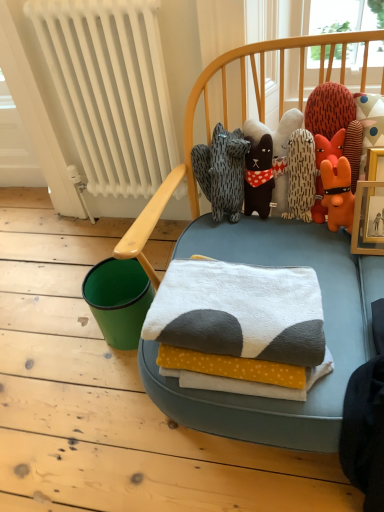
Question: Is soft plush toys at center, the 2th toy when ordered from right to left, in front of or behind white soft towel at center in the image?

Choices:
 (A) front
 (B) behind

Answer: (B)

Question: Is point (249, 119) closer or farther from the camera than point (172, 295)?

Choices:
 (A) farther
 (B) closer

Answer: (A)

Question: Estimate the real-world distances between objects in this image. Which object is farther from the white soft towel at center?

Choices:
 (A) white painted metal radiator at left
 (B) soft plush toys at center, which appears as the first toy when viewed from the left
 (C) orange plush toy at upper right, the second toy when ordered from left to right

Answer: (A)

Question: Which of these objects is positioned closest to the orange plush toy at upper right, which ranks as the 1th toy in right-to-left order?

Choices:
 (A) white painted metal radiator at left
 (B) soft plush toys at center, the 2th toy when ordered from right to left
 (C) white soft towel at center

Answer: (B)